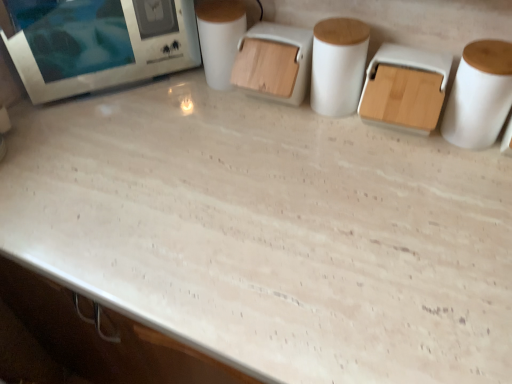
Question: Is white matte paper towel at right, the 1th paper towel from the right, outside white matte toilet paper at center?

Choices:
 (A) no
 (B) yes

Answer: (B)

Question: Does white matte paper towel at right, the 2th paper towel from the left, appear on the right side of white matte toilet paper at center?

Choices:
 (A) no
 (B) yes

Answer: (B)

Question: Is the depth of white matte paper towel at right, the 1th paper towel from the right, greater than that of white matte toilet paper at center?

Choices:
 (A) yes
 (B) no

Answer: (B)

Question: Is white matte paper towel at right, the 2th paper towel from the left, thinner than white matte toilet paper at center?

Choices:
 (A) yes
 (B) no

Answer: (B)

Question: Is white matte paper towel at right, the 1th paper towel from the right, positioned with its back to white matte toilet paper at center?

Choices:
 (A) yes
 (B) no

Answer: (B)

Question: Can you confirm if white matte paper towel at right, the 2th paper towel from the left, is shorter than white matte toilet paper at center?

Choices:
 (A) no
 (B) yes

Answer: (B)

Question: Is white glossy microwave at upper left aimed at wooden lid container at center?

Choices:
 (A) no
 (B) yes

Answer: (A)

Question: Is white glossy microwave at upper left facing away from wooden lid container at center?

Choices:
 (A) yes
 (B) no

Answer: (B)

Question: Is white glossy microwave at upper left placed right next to wooden lid container at center?

Choices:
 (A) no
 (B) yes

Answer: (A)

Question: Is white glossy microwave at upper left positioned in front of wooden lid container at center?

Choices:
 (A) no
 (B) yes

Answer: (A)

Question: Is white glossy microwave at upper left at the left side of wooden lid container at center?

Choices:
 (A) yes
 (B) no

Answer: (A)

Question: Does white glossy microwave at upper left have a greater height compared to wooden lid container at center?

Choices:
 (A) no
 (B) yes

Answer: (B)

Question: Is white matte toilet paper at center placed right next to white matte paper towel at right, the 2th paper towel from the left?

Choices:
 (A) yes
 (B) no

Answer: (B)